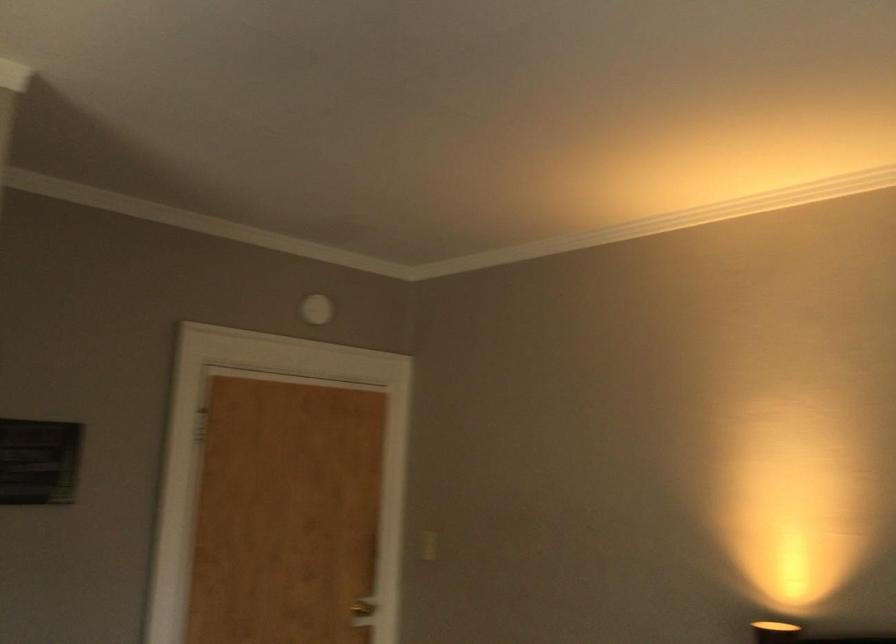
The width and height of the screenshot is (896, 644). Identify the location of door handle. (362, 612).